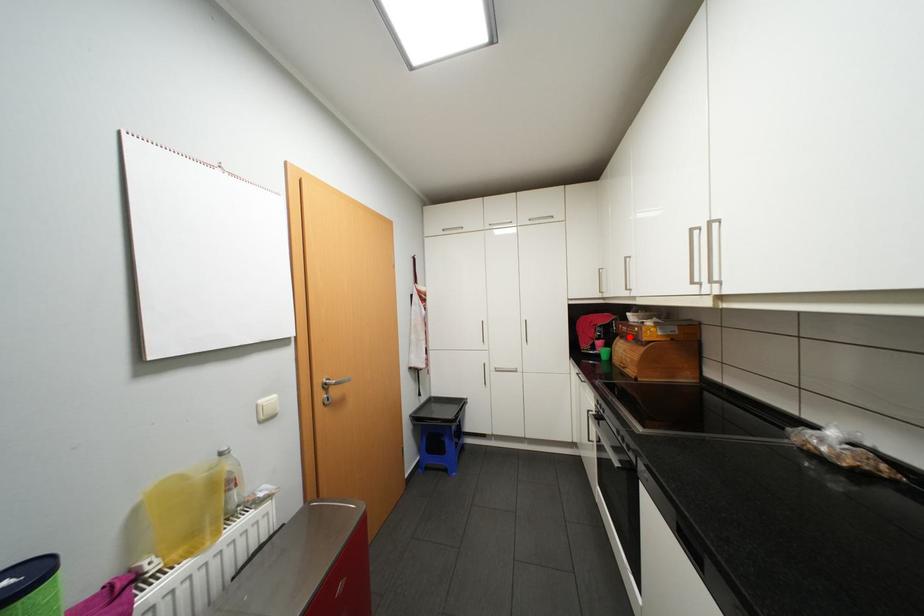
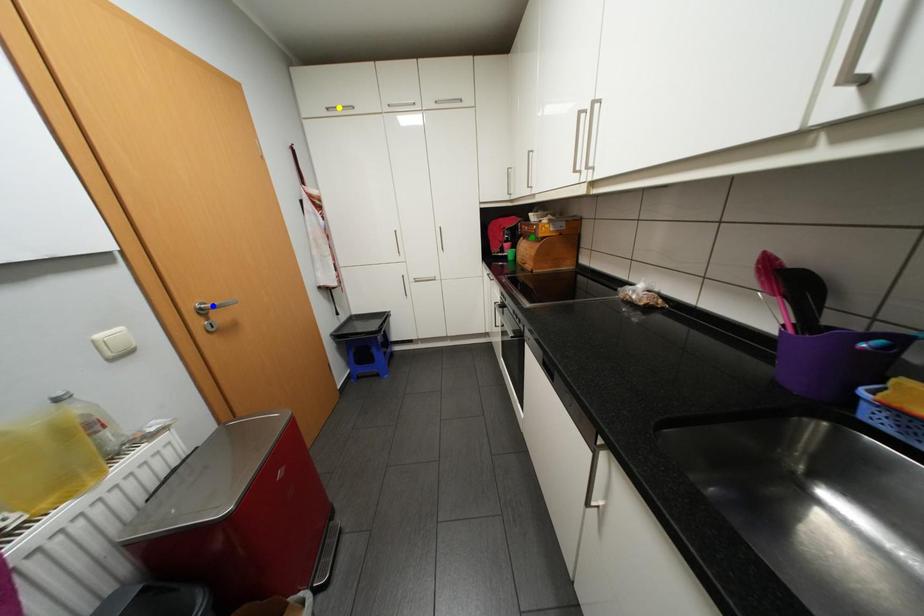
Question: I am providing you with two images of the same scene from different viewpoints. A red point is marked on the first image. You are given multiple points on the second image. In image 2, which mark is for the same physical point as the one in image 1?

Choices:
 (A) blue point
 (B) green point
 (C) yellow point

Answer: (B)